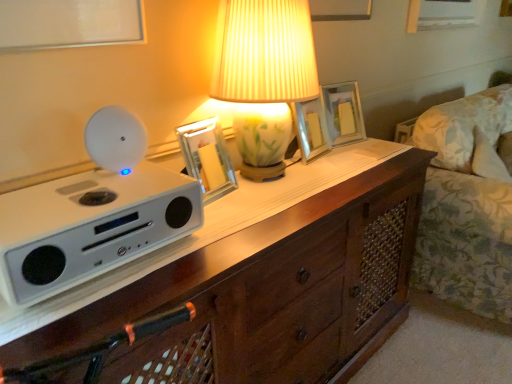
The image size is (512, 384). Find the location of `empty space that is to the right of white matte speaker at left`. empty space that is to the right of white matte speaker at left is located at coordinates (215, 244).